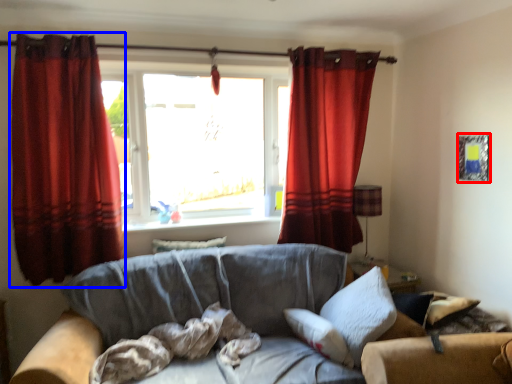
Question: Which object is further to the camera taking this photo, picture frame (highlighted by a red box) or curtain (highlighted by a blue box)?

Choices:
 (A) picture frame
 (B) curtain

Answer: (A)